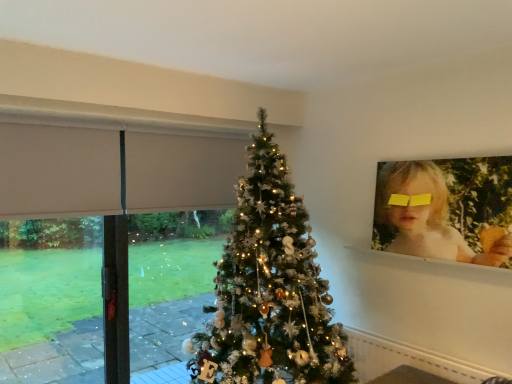
Question: Is white glossy window sill at upper right facing towards beige fabric at left?

Choices:
 (A) yes
 (B) no

Answer: (B)

Question: Is there a large distance between white glossy window sill at upper right and beige fabric at left?

Choices:
 (A) no
 (B) yes

Answer: (B)

Question: Considering the relative sizes of white glossy window sill at upper right and beige fabric at left in the image provided, is white glossy window sill at upper right wider than beige fabric at left?

Choices:
 (A) no
 (B) yes

Answer: (B)

Question: Is beige fabric at left located within white glossy window sill at upper right?

Choices:
 (A) no
 (B) yes

Answer: (A)

Question: From the image's perspective, is white glossy window sill at upper right below beige fabric at left?

Choices:
 (A) yes
 (B) no

Answer: (B)

Question: Is white glossy window sill at upper right thinner than beige fabric at left?

Choices:
 (A) yes
 (B) no

Answer: (B)

Question: From a real-world perspective, is blonde hair at upper right physically below white glossy window sill at upper right?

Choices:
 (A) no
 (B) yes

Answer: (A)

Question: Is blonde hair at upper right surrounding white glossy window sill at upper right?

Choices:
 (A) yes
 (B) no

Answer: (A)

Question: Is blonde hair at upper right placed right next to white glossy window sill at upper right?

Choices:
 (A) no
 (B) yes

Answer: (A)

Question: Can you confirm if blonde hair at upper right is smaller than white glossy window sill at upper right?

Choices:
 (A) no
 (B) yes

Answer: (A)

Question: Can you confirm if blonde hair at upper right is bigger than white glossy window sill at upper right?

Choices:
 (A) yes
 (B) no

Answer: (A)

Question: Does blonde hair at upper right have a lesser width compared to white glossy window sill at upper right?

Choices:
 (A) no
 (B) yes

Answer: (B)

Question: Is blonde hair at upper right positioned beyond the bounds of beige fabric at left?

Choices:
 (A) yes
 (B) no

Answer: (A)